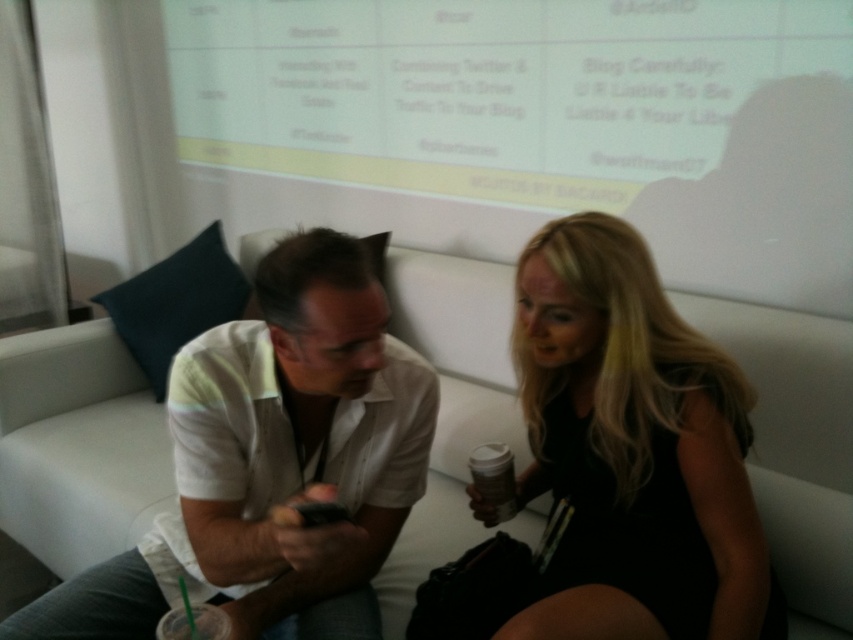
Question: Which point appears closest to the camera in this image?

Choices:
 (A) (486, 492)
 (B) (61, 602)
 (C) (695, 438)

Answer: (C)

Question: Is white cotton shirt at center positioned in front of white matte cup at lower center?

Choices:
 (A) yes
 (B) no

Answer: (A)

Question: Can you confirm if white cotton shirt at center is positioned below white matte cup at lower center?

Choices:
 (A) yes
 (B) no

Answer: (B)

Question: Among these objects, which one is nearest to the camera?

Choices:
 (A) black matte dress at center
 (B) white cotton shirt at center

Answer: (B)

Question: From the image, what is the correct spatial relationship of black matte dress at center in relation to white matte cup at lower center?

Choices:
 (A) left
 (B) right

Answer: (B)

Question: Which of the following is the farthest from the observer?

Choices:
 (A) (401, 432)
 (B) (625, 486)

Answer: (A)